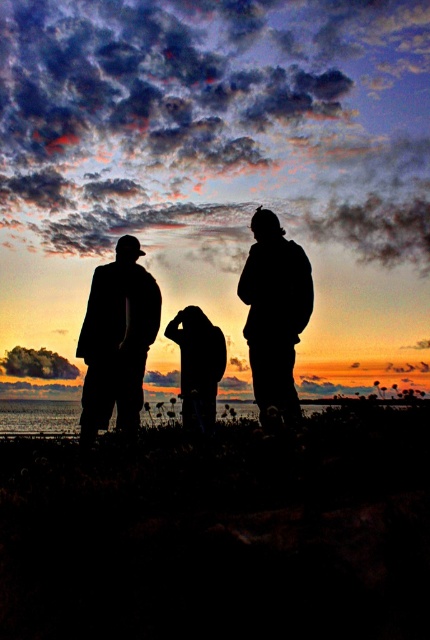
Question: Does silhouette suit at left have a greater width compared to silhouette jacket at right?

Choices:
 (A) no
 (B) yes

Answer: (B)

Question: Does grassy beach at lower center appear on the left side of silhouette jacket at right?

Choices:
 (A) yes
 (B) no

Answer: (A)

Question: Which of the following is the farthest from the observer?

Choices:
 (A) (134, 417)
 (B) (272, 538)

Answer: (A)

Question: Does grassy beach at lower center appear on the left side of silhouette jacket at right?

Choices:
 (A) no
 (B) yes

Answer: (B)

Question: Which point is closer to the camera?

Choices:
 (A) silhouette suit at left
 (B) grassy beach at lower center
 (C) silhouette jacket at right

Answer: (B)

Question: Considering the real-world distances, which object is farthest from the silhouette jacket at right?

Choices:
 (A) grassy beach at lower center
 (B) silhouette suit at left

Answer: (A)